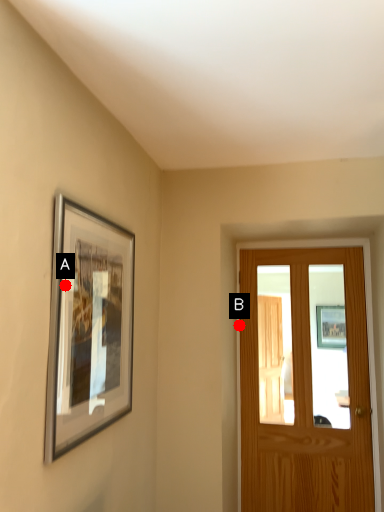
Question: Two points are circled on the image, labeled by A and B beside each circle. Which point appears farthest from the camera in this image?

Choices:
 (A) A is further
 (B) B is further

Answer: (B)